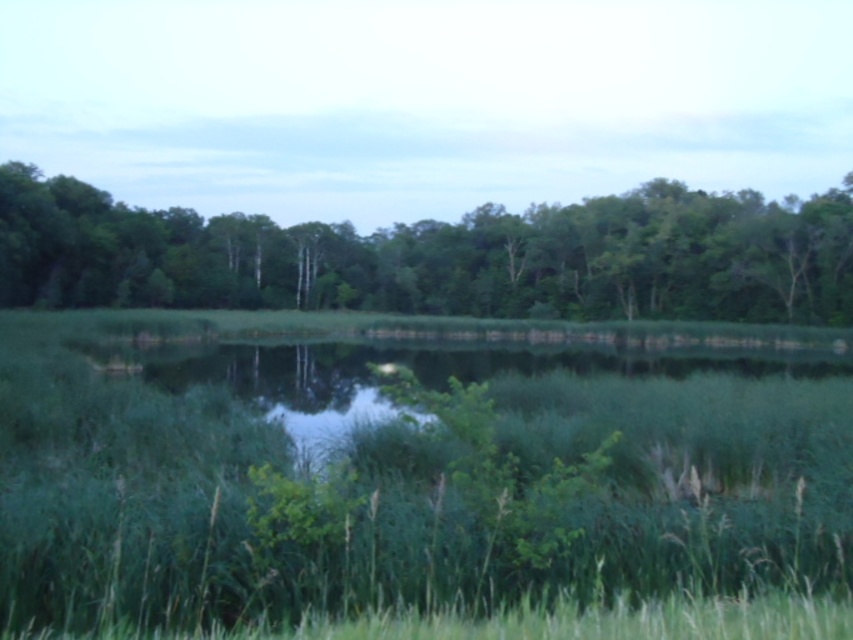
You are standing at the center of the image and see a point marked at coordinates (416, 470). According to the scene description, what is the color of the area where this point is located?

The point at (416, 470) is located on green grass at center, so the area is green in color.

You are standing in the middle of the green grass at center and looking towards the green leafy trees at center. Which object is taller?

The green leafy trees at center are taller than the green grass at center.

You are an observer standing in the middle of the scene. You notice two elements at the center of the image, the green grass at center and the green leafy trees at center. Which of these two elements appears to be physically closer to you?

The green grass at center appears closer because it is smaller in size compared to the green leafy trees at center. In perspective, objects that are closer tend to appear smaller when they are actually closer, but wait, actually larger. Hmm, maybe I need to think again. Wait the description says the grass has smaller size compared to the trees. So if the grass is smaller, maybe it is farther? Wait perspective rules. Wait, in perspective, closer objects appear larger. So if the grass is smaller than the tree